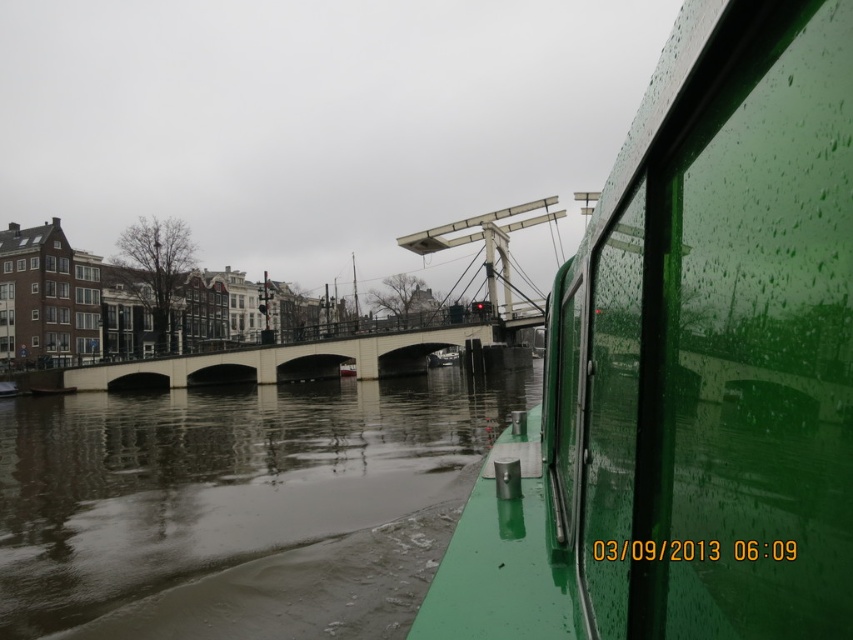
Does smooth water at center lie behind white concrete bridge at center?

No, smooth water at center is in front of white concrete bridge at center.

Can you confirm if smooth water at center is smaller than white concrete bridge at center?

Yes.

Does point (331, 467) lie in front of point (386, 333)?

Yes, it is.

Locate an element on the screen. The image size is (853, 640). smooth water at center is located at coordinates (236, 506).